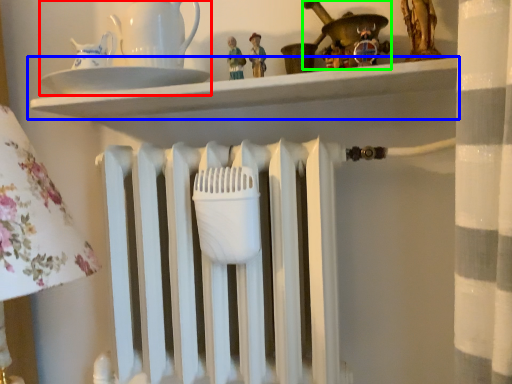
Question: Estimate the real-world distances between objects in this image. Which object is farther from tea set (highlighted by a red box), shelf (highlighted by a blue box) or toy (highlighted by a green box)?

Choices:
 (A) shelf
 (B) toy

Answer: (B)